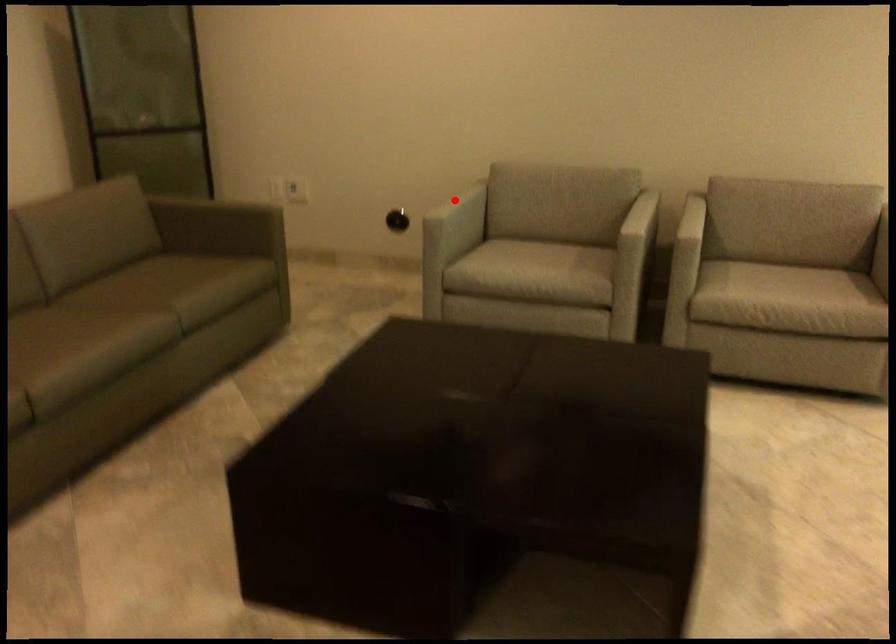
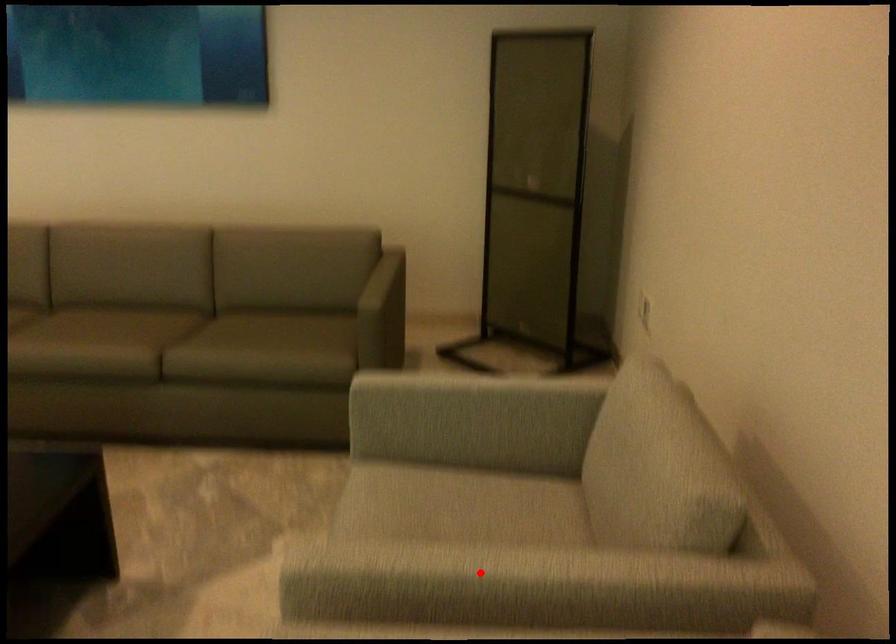
Consider the image. I am providing you with two images of the same scene from different viewpoints. A red point is marked on the first image and another point is marked on the second image. Are the points marked in image1 and image2 representing the same 3D position?

No